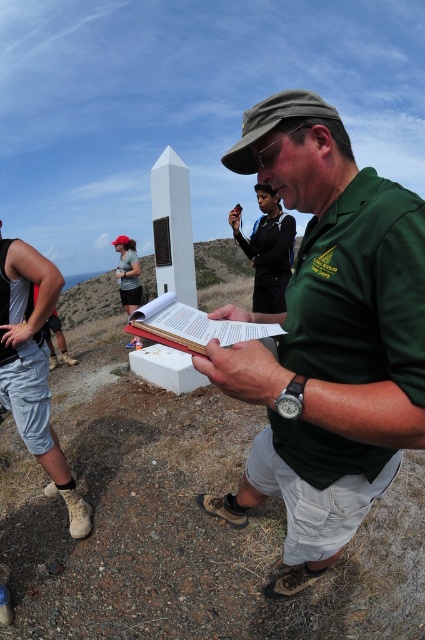
Question: Which is farther from the brushed metal shorts at lower left?

Choices:
 (A) green fabric shirt at center
 (B) white paper book at center

Answer: (A)

Question: Which point appears closest to the camera in this image?

Choices:
 (A) (147, 308)
 (B) (263, 282)
 (C) (393, 452)

Answer: (A)

Question: Is green fabric shirt at center below brushed metal shorts at lower left?

Choices:
 (A) yes
 (B) no

Answer: (A)

Question: Does green fabric shirt at center have a lesser width compared to white paper book at center?

Choices:
 (A) yes
 (B) no

Answer: (B)

Question: Which is nearer to the white paper book at center?

Choices:
 (A) green fabric shirt at center
 (B) black fabric shirt at center
 (C) brushed metal shorts at lower left

Answer: (A)

Question: Does green fabric shirt at center have a greater width compared to black fabric shirt at center?

Choices:
 (A) yes
 (B) no

Answer: (B)